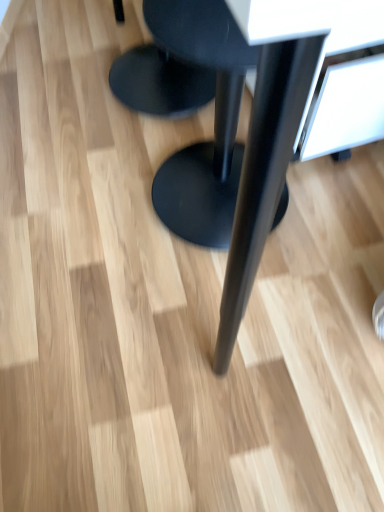
Locate an element on the screen. This screenshot has height=512, width=384. black matte table at center is located at coordinates (280, 122).

Identify the location of black matte stool at center, placed as the 1th stool when sorted from bottom to top. The width and height of the screenshot is (384, 512). (214, 121).

Describe the element at coordinates (214, 121) in the screenshot. Image resolution: width=384 pixels, height=512 pixels. I see `black matte stool at center, which is the second stool in top-to-bottom order` at that location.

What do you see at coordinates (160, 82) in the screenshot? I see `black matte stool at center, the 2th stool positioned from the bottom` at bounding box center [160, 82].

In order to face black matte stool at center, which is the first stool from top to bottom, should I rotate leftwards or rightwards?

To align with it, rotate left about 4.836°.

In order to click on black matte table at center in this screenshot , I will do `click(280, 122)`.

From the image's perspective, is black matte stool at center, the 2th stool positioned from the bottom, over black matte stool at center, which is the second stool in top-to-bottom order?

Correct, black matte stool at center, the 2th stool positioned from the bottom, appears higher than black matte stool at center, which is the second stool in top-to-bottom order, in the image.

Consider the image. Is black matte stool at center, placed as the 1th stool when sorted from bottom to top, inside black matte stool at center, the 2th stool positioned from the bottom?

No, black matte stool at center, placed as the 1th stool when sorted from bottom to top, is not inside black matte stool at center, the 2th stool positioned from the bottom.

Is black matte stool at center, the 2th stool positioned from the bottom, facing away from black matte stool at center, which is the second stool in top-to-bottom order?

black matte stool at center, the 2th stool positioned from the bottom, is not turned away from black matte stool at center, which is the second stool in top-to-bottom order.

How many degrees apart are the facing directions of black matte table at center and black matte stool at center, which is the first stool from top to bottom?

They differ by 178 degrees in their facing directions.

Looking at this image, considering the sizes of objects black matte table at center and black matte stool at center, which is the first stool from top to bottom, in the image provided, who is wider, black matte table at center or black matte stool at center, which is the first stool from top to bottom,?

black matte table at center is wider.

From the image's perspective, is black matte table at center above black matte stool at center, which is the first stool from top to bottom?

No, from the image's perspective, black matte table at center is not over black matte stool at center, which is the first stool from top to bottom.

Is point (250, 164) farther from viewer compared to point (180, 87)?

That is False.

In the image, is black matte stool at center, placed as the 1th stool when sorted from bottom to top, positioned in front of or behind black matte stool at center, the 2th stool positioned from the bottom?

black matte stool at center, placed as the 1th stool when sorted from bottom to top, is in front of black matte stool at center, the 2th stool positioned from the bottom.

Are black matte stool at center, which is the second stool in top-to-bottom order, and black matte stool at center, the 2th stool positioned from the bottom, located far from each other?

No, black matte stool at center, which is the second stool in top-to-bottom order, is in close proximity to black matte stool at center, the 2th stool positioned from the bottom.

From the picture: Is black matte stool at center, placed as the 1th stool when sorted from bottom to top, aimed at black matte stool at center, which is the first stool from top to bottom?

No, black matte stool at center, placed as the 1th stool when sorted from bottom to top, is not aimed at black matte stool at center, which is the first stool from top to bottom.

I want to click on stool directly beneath the black matte stool at center, which is the second stool in top-to-bottom order (from a real-world perspective), so click(160, 82).

From the image's perspective, does black matte table at center appear lower than black matte stool at center, placed as the 1th stool when sorted from bottom to top?

Actually, black matte table at center appears above black matte stool at center, placed as the 1th stool when sorted from bottom to top, in the image.

What's the angular difference between black matte table at center and black matte stool at center, which is the second stool in top-to-bottom order,'s facing directions?

They differ by 178 degrees in their facing directions.

From a real-world perspective, is black matte table at center physically above black matte stool at center, which is the second stool in top-to-bottom order?

Yes, from a real-world perspective, black matte table at center is on top of black matte stool at center, which is the second stool in top-to-bottom order.

Considering the sizes of objects black matte table at center and black matte stool at center, which is the second stool in top-to-bottom order, in the image provided, who is smaller, black matte table at center or black matte stool at center, which is the second stool in top-to-bottom order,?

Smaller between the two is black matte stool at center, which is the second stool in top-to-bottom order.

From the image's perspective, does black matte stool at center, placed as the 1th stool when sorted from bottom to top, appear lower than black matte table at center?

Indeed, from the image's perspective, black matte stool at center, placed as the 1th stool when sorted from bottom to top, is shown beneath black matte table at center.

Which object is closer to the camera taking this photo, black matte stool at center, placed as the 1th stool when sorted from bottom to top, or black matte table at center?

black matte table at center is closer to the camera.

Which object is wider, black matte stool at center, which is the second stool in top-to-bottom order, or black matte table at center?

black matte table at center is wider.

Which of these two, black matte stool at center, which is the first stool from top to bottom, or black matte table at center, stands taller?

Standing taller between the two is black matte table at center.

Does black matte stool at center, which is the first stool from top to bottom, lie in front of black matte table at center?

No, it is not.

Is black matte stool at center, which is the first stool from top to bottom, oriented away from black matte table at center?

Yes, black matte table at center is at the back of black matte stool at center, which is the first stool from top to bottom.

Is black matte stool at center, the 2th stool positioned from the bottom, spatially inside black matte table at center, or outside of it?

black matte stool at center, the 2th stool positioned from the bottom, exists entirely within black matte table at center.

Identify the location of stool in front of the black matte stool at center, which is the first stool from top to bottom. This screenshot has width=384, height=512. (214, 121).

Which stool is the 2nd one when counting from the back of the black matte table at center? Please provide its 2D coordinates.

[(160, 82)]

Considering their positions, is black matte table at center positioned closer to black matte stool at center, which is the second stool in top-to-bottom order, than black matte stool at center, the 2th stool positioned from the bottom?

black matte table at center is closer to black matte stool at center, which is the second stool in top-to-bottom order.

Which object lies further to the anchor point black matte table at center, black matte stool at center, placed as the 1th stool when sorted from bottom to top, or black matte stool at center, the 2th stool positioned from the bottom?

black matte stool at center, the 2th stool positioned from the bottom, is further to black matte table at center.

Estimate the real-world distances between objects in this image. Which object is closer to black matte stool at center, which is the second stool in top-to-bottom order, black matte stool at center, the 2th stool positioned from the bottom, or black matte table at center?

black matte table at center lies closer to black matte stool at center, which is the second stool in top-to-bottom order, than the other object.

When comparing their distances from black matte stool at center, which is the first stool from top to bottom, does black matte stool at center, placed as the 1th stool when sorted from bottom to top, or black matte table at center seem closer?

black matte stool at center, placed as the 1th stool when sorted from bottom to top, is closer to black matte stool at center, which is the first stool from top to bottom.

Based on their spatial positions, is black matte stool at center, which is the first stool from top to bottom, or black matte stool at center, which is the second stool in top-to-bottom order, further from black matte table at center?

black matte stool at center, which is the first stool from top to bottom, is further to black matte table at center.

Estimate the real-world distances between objects in this image. Which object is further from black matte stool at center, which is the first stool from top to bottom, black matte table at center or black matte stool at center, placed as the 1th stool when sorted from bottom to top?

black matte table at center is positioned further to the anchor black matte stool at center, which is the first stool from top to bottom.

In order to click on stool between black matte table at center and black matte stool at center, the 2th stool positioned from the bottom, from front to back in this screenshot , I will do `click(214, 121)`.